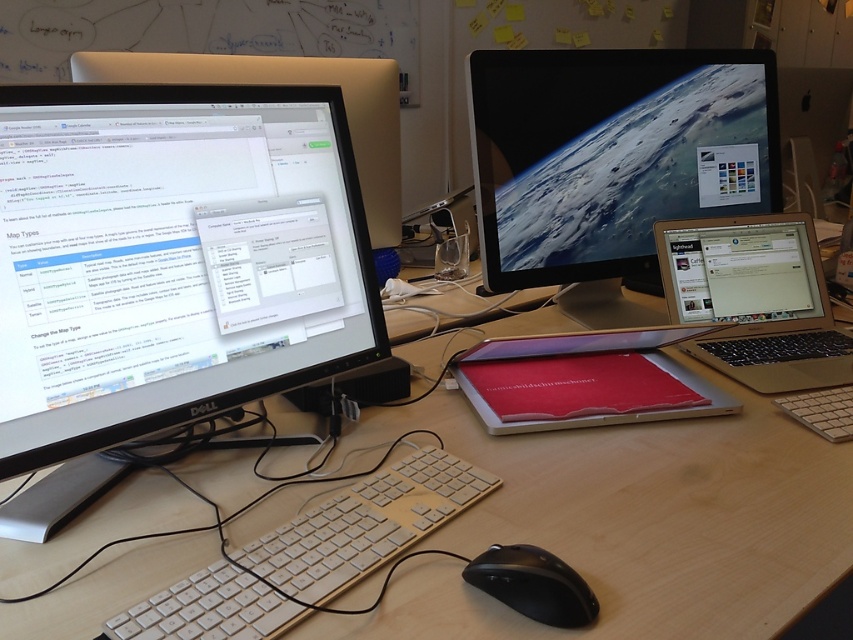
You are organizing your desk and want to place a new object between the wooden at center and the red matte tablet at center. Can you do this without moving either of them?

The wooden at center is in front of the red matte tablet at center, so there is no space between them to place a new object without moving either of them.